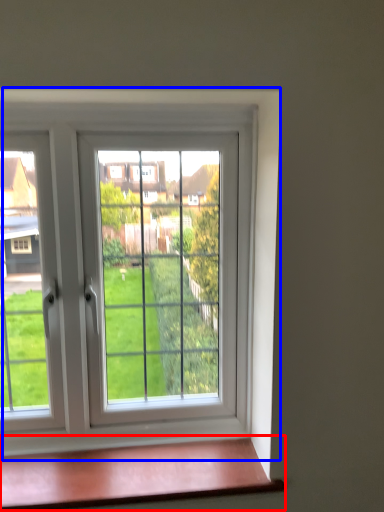
Question: Which point is closer to the camera, window sill (highlighted by a red box) or window (highlighted by a blue box)?

Choices:
 (A) window sill
 (B) window

Answer: (A)